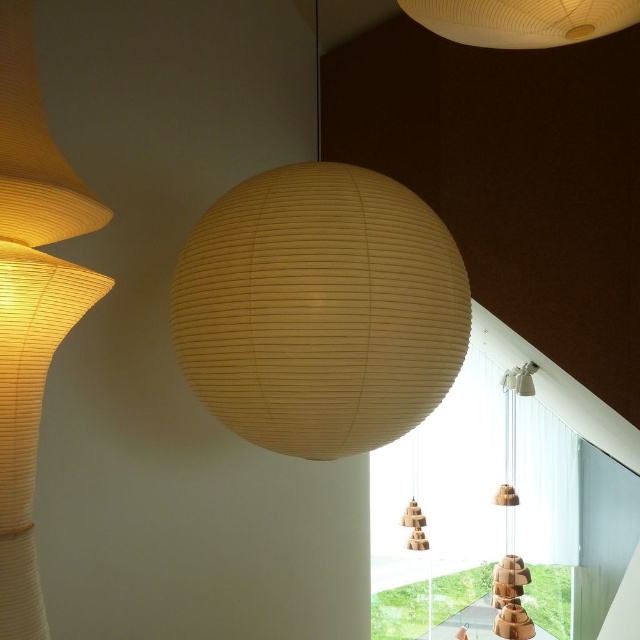
Question: Is wooden at right positioned behind wooden tower at center?

Choices:
 (A) no
 (B) yes

Answer: (B)

Question: Does wooden at right come in front of wooden tower at center?

Choices:
 (A) no
 (B) yes

Answer: (A)

Question: Which object appears closest to the camera in this image?

Choices:
 (A) matte beige paper lampshade at left
 (B) wooden at right
 (C) matte paper lamp at center

Answer: (A)

Question: Among these objects, which one is farthest from the camera?

Choices:
 (A) wooden tower at center
 (B) matte white sphere at upper center
 (C) wooden at right
 (D) matte paper lamp at center

Answer: (C)

Question: Which of the following is the farthest from the observer?

Choices:
 (A) (492, 600)
 (B) (404, 518)

Answer: (B)

Question: Can you confirm if matte beige paper lampshade at left is bigger than matte white sphere at upper center?

Choices:
 (A) no
 (B) yes

Answer: (B)